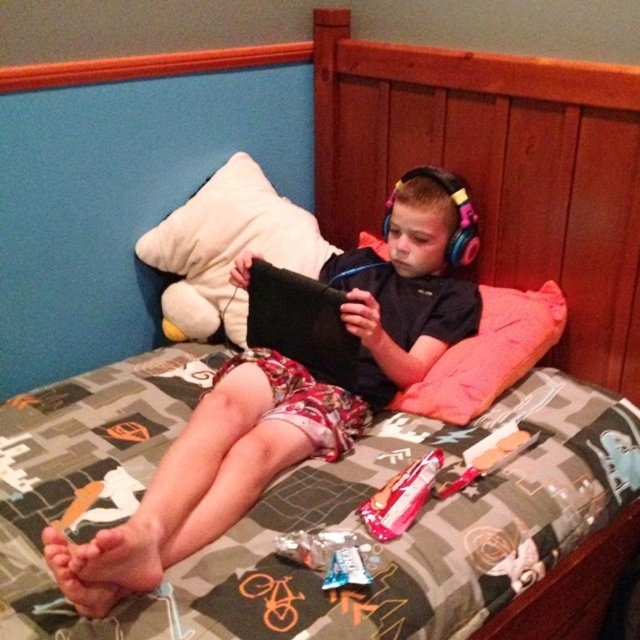
Does wooden at upper center have a lesser width compared to black matte tablet at center?

Correct, wooden at upper center's width is less than black matte tablet at center's.

Between point (515, 269) and point (100, 540), which one is positioned behind?

Positioned behind is point (515, 269).

Where is `wooden at upper center`? The height and width of the screenshot is (640, 640). wooden at upper center is located at coordinates (497, 170).

Who is positioned more to the right, black matte tablet at center or white plush at upper left?

black matte tablet at center

How distant is black matte tablet at center from white plush at upper left?

black matte tablet at center is 12.86 inches away from white plush at upper left.

Between point (156, 579) and point (140, 246), which one is positioned in front?

Point (156, 579)

Where is `black matte tablet at center`? black matte tablet at center is located at coordinates (285, 403).

Is point (147, 236) more distant than point (492, 298)?

Yes, it is behind point (492, 298).

Is point (211, 209) behind point (476, 392)?

Yes, point (211, 209) is behind point (476, 392).

Where is `white plush at upper left`? This screenshot has height=640, width=640. white plush at upper left is located at coordinates (227, 248).